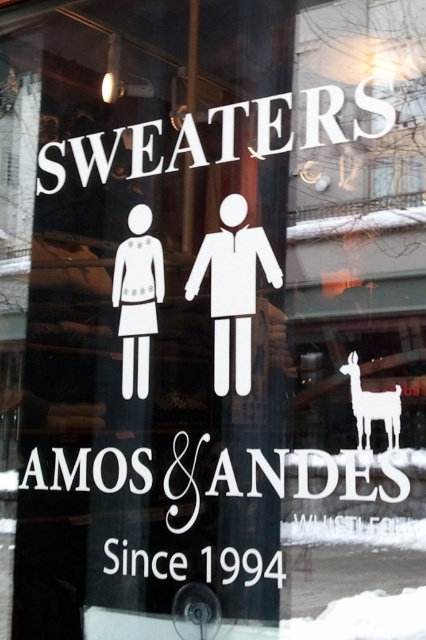
Question: Does white paper figure at left appear on the right side of white matte llama at upper right?

Choices:
 (A) no
 (B) yes

Answer: (A)

Question: Can you confirm if white matte sign at upper center is bigger than white paper figure at left?

Choices:
 (A) no
 (B) yes

Answer: (B)

Question: Can you confirm if white matte sign at upper center is smaller than white paper figure at left?

Choices:
 (A) yes
 (B) no

Answer: (B)

Question: Which object is the closest to the white paper figure at left?

Choices:
 (A) white matte sign at upper center
 (B) white matte llama at upper right

Answer: (A)

Question: Which is nearer to the white matte sign at upper center?

Choices:
 (A) white paper figure at left
 (B) white matte llama at upper right

Answer: (A)

Question: Among these points, which one is nearest to the camera?

Choices:
 (A) (131, 212)
 (B) (344, 372)
 (C) (135, 141)

Answer: (B)